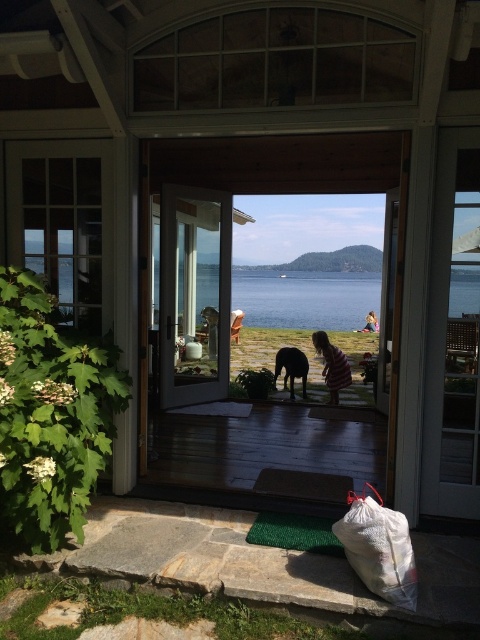
Question: Which of the following is the closest to the observer?

Choices:
 (A) blue water at center
 (B) clear glass screen door at center
 (C) wooden deck at center
 (D) pink striped dress at center

Answer: (A)

Question: Which object is the farthest from the clear glass screen door at center?

Choices:
 (A) shiny black dog at center
 (B) wooden deck at center
 (C) pink striped dress at center

Answer: (C)

Question: Is blue water at center further to the viewer compared to shiny black dog at center?

Choices:
 (A) yes
 (B) no

Answer: (B)

Question: Is clear glass screen door at center thinner than pink striped dress at center?

Choices:
 (A) yes
 (B) no

Answer: (B)

Question: Can you confirm if wooden deck at center is wider than shiny black dog at center?

Choices:
 (A) no
 (B) yes

Answer: (B)

Question: Among these objects, which one is farthest from the camera?

Choices:
 (A) shiny black dog at center
 (B) blue water at center
 (C) pink striped dress at center

Answer: (A)